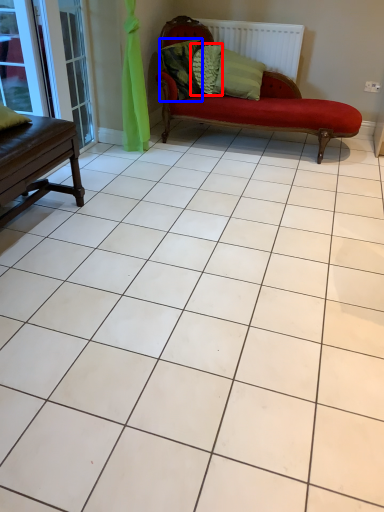
Question: Which object appears farthest to the camera in this image, pillow (highlighted by a red box) or pillow (highlighted by a blue box)?

Choices:
 (A) pillow
 (B) pillow

Answer: (A)